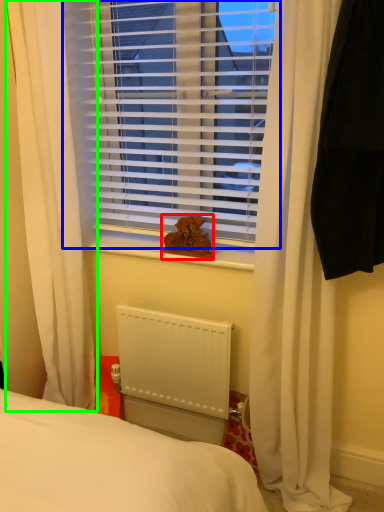
Question: Estimate the real-world distances between objects in this image. Which object is farther from animal (highlighted by a red box), window blind (highlighted by a blue box) or curtain (highlighted by a green box)?

Choices:
 (A) window blind
 (B) curtain

Answer: (B)